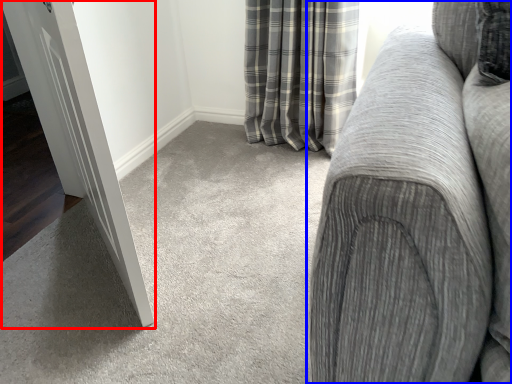
Question: Which object appears closest to the camera in this image, door (highlighted by a red box) or studio couch (highlighted by a blue box)?

Choices:
 (A) door
 (B) studio couch

Answer: (B)